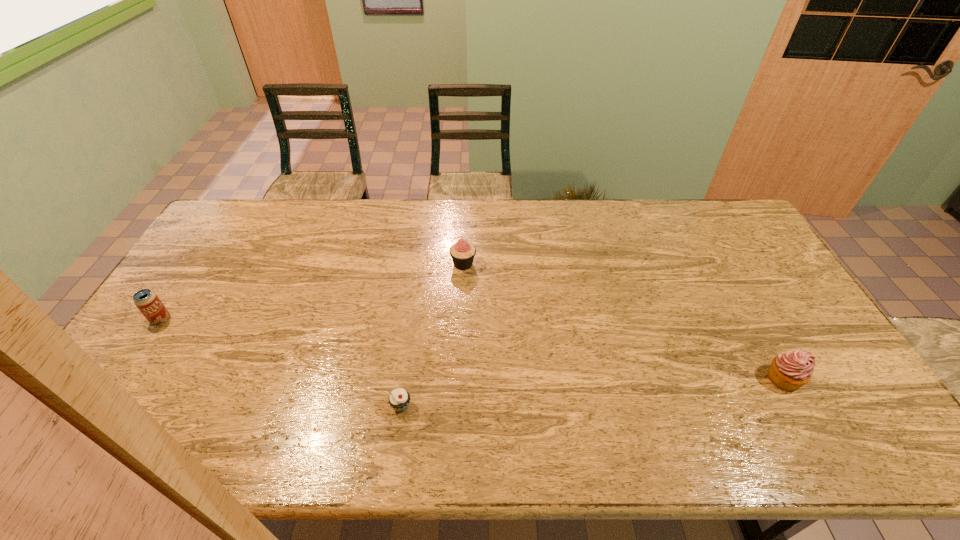
Locate an element on the screen. Image resolution: width=960 pixels, height=540 pixels. vacant space at the near right corner of the desktop is located at coordinates (840, 456).

The height and width of the screenshot is (540, 960). Find the location of `free space between the third object from left to right and the third farthest object`. free space between the third object from left to right and the third farthest object is located at coordinates (623, 321).

Find the location of `vacant space that is in between the shortest object and the rightmost object`. vacant space that is in between the shortest object and the rightmost object is located at coordinates (592, 393).

You are a GUI agent. You are given a task and a screenshot of the screen. Output one action in this format:
    pyautogui.click(x=<x>, y=<y>)
    Task: Click on the unoccupied area between the second nearest cupcake and the leftmost cupcake
    The height and width of the screenshot is (540, 960).
    Given the screenshot: What is the action you would take?
    pyautogui.click(x=592, y=393)

You are a GUI agent. You are given a task and a screenshot of the screen. Output one action in this format:
    pyautogui.click(x=<x>, y=<y>)
    Task: Click on the vacant area that lies between the leftmost object and the nearest cupcake
    The width and height of the screenshot is (960, 540).
    Given the screenshot: What is the action you would take?
    pyautogui.click(x=281, y=363)

Find the location of a particular element. The image size is (960, 540). free space between the second object from right to left and the rightmost cupcake is located at coordinates (623, 321).

You are a GUI agent. You are given a task and a screenshot of the screen. Output one action in this format:
    pyautogui.click(x=<x>, y=<y>)
    Task: Click on the vacant area between the farthest object and the second farthest object
    
    Given the screenshot: What is the action you would take?
    pyautogui.click(x=312, y=292)

This screenshot has height=540, width=960. What are the coordinates of `free spot between the nearest cupcake and the second nearest object` in the screenshot? It's located at (592, 393).

Locate an element on the screen. Image resolution: width=960 pixels, height=540 pixels. vacant area that lies between the third farthest object and the leftmost cupcake is located at coordinates (592, 393).

The height and width of the screenshot is (540, 960). I want to click on free space that is in between the leftmost cupcake and the beer can, so click(281, 363).